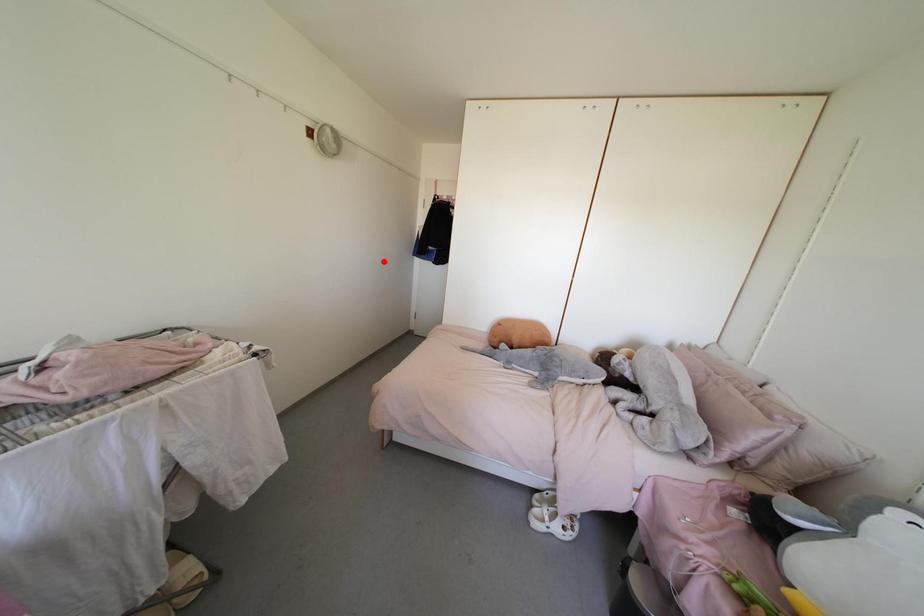
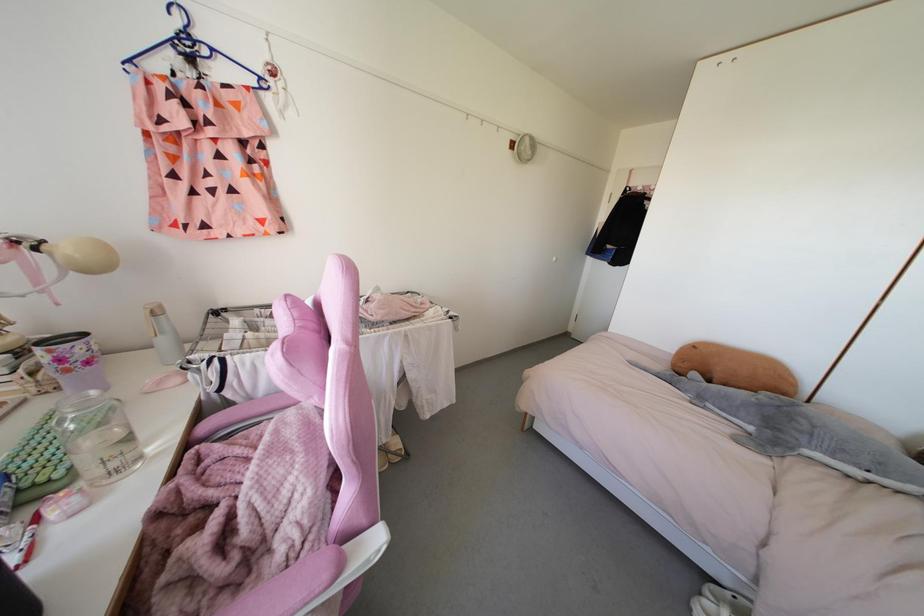
Question: I am providing you with two images of the same scene from different viewpoints. In image1, a red point is highlighted. Considering the same 3D point in image2, which of the following is correct?

Choices:
 (A) It is closer
 (B) It is farther

Answer: (B)